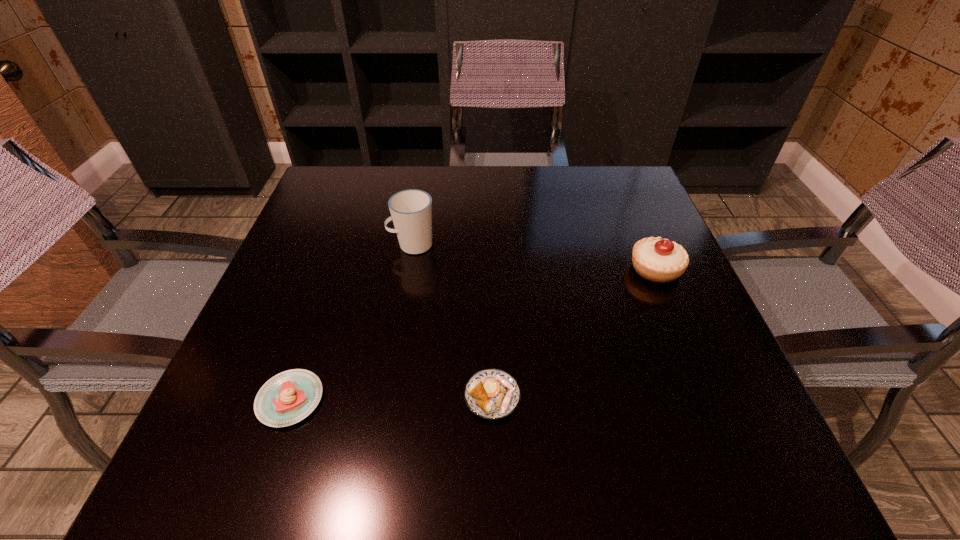
Where is `free space that satisfies the following two spatial constraints: 1. with a handle on the side of the second object from left to right; 2. on the back side of the second object from right to left`? The height and width of the screenshot is (540, 960). free space that satisfies the following two spatial constraints: 1. with a handle on the side of the second object from left to right; 2. on the back side of the second object from right to left is located at coordinates (386, 396).

Locate an element on the screen. The height and width of the screenshot is (540, 960). free space that satisfies the following two spatial constraints: 1. with a handle on the side of the farthest pastry; 2. on the left side of the cup is located at coordinates (408, 269).